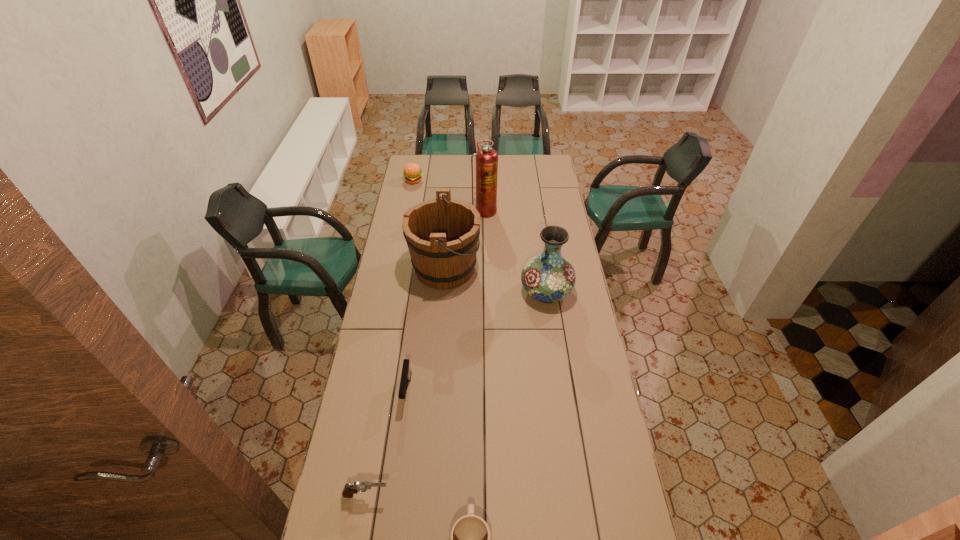
This screenshot has height=540, width=960. What are the coordinates of `blank space that satisfies the following two spatial constraints: 1. on the front-facing side of the farther pistol; 2. at the barrel of the second nearest object` in the screenshot? It's located at (394, 495).

Locate an element on the screen. The image size is (960, 540). free space that satisfies the following two spatial constraints: 1. on the side of the tallest object with the label; 2. on the side of the wine bucket with the handle for carrying is located at coordinates (485, 268).

Where is `vacant space that satisfies the following two spatial constraints: 1. on the front-facing side of the fifth farthest object; 2. at the barrel of the nearer pistol`? This screenshot has height=540, width=960. vacant space that satisfies the following two spatial constraints: 1. on the front-facing side of the fifth farthest object; 2. at the barrel of the nearer pistol is located at coordinates (394, 495).